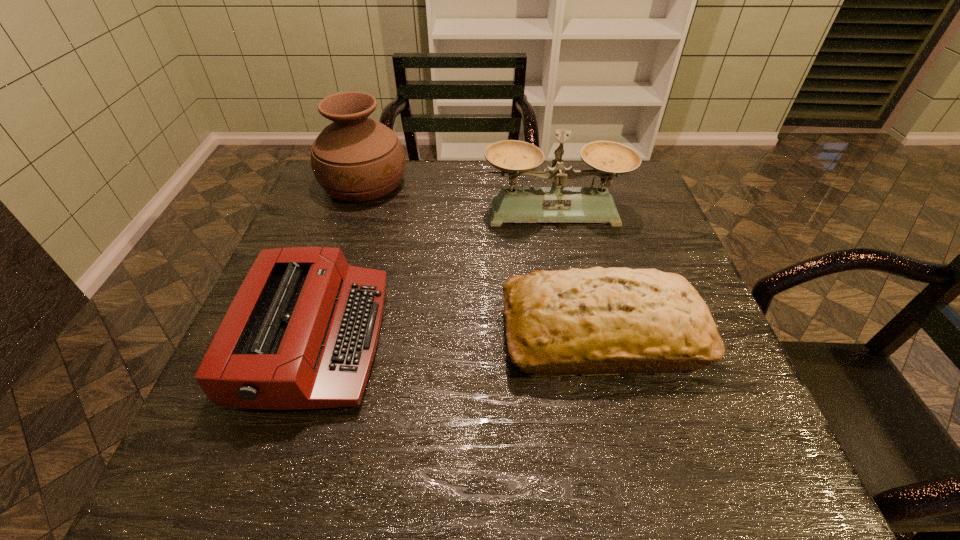
Image resolution: width=960 pixels, height=540 pixels. I want to click on urn, so click(355, 158).

The height and width of the screenshot is (540, 960). Identify the location of scale. coord(557,204).

Locate an element on the screen. the third tallest object is located at coordinates (595, 321).

You are a GUI agent. You are given a task and a screenshot of the screen. Output one action in this format:
    pyautogui.click(x=<x>, y=<y>)
    Task: Click on the typewriter
    
    Given the screenshot: What is the action you would take?
    pyautogui.click(x=301, y=333)

Where is `vacant space located on the right of the urn`? vacant space located on the right of the urn is located at coordinates (469, 183).

The width and height of the screenshot is (960, 540). I want to click on vacant region located on the front-facing side of the scale, so click(568, 279).

Identify the location of free spot located on the left of the bread. Image resolution: width=960 pixels, height=540 pixels. (468, 335).

Find the location of a particular element. This screenshot has width=960, height=540. free spot located on the typing side of the shortest object is located at coordinates (519, 339).

Locate an element on the screen. The image size is (960, 540). urn that is at the far edge is located at coordinates (355, 158).

You are a GUI agent. You are given a task and a screenshot of the screen. Output one action in this format:
    pyautogui.click(x=<x>, y=<y>)
    Task: Click on the scale that is positioned at the far edge
    Image resolution: width=960 pixels, height=540 pixels.
    Given the screenshot: What is the action you would take?
    pyautogui.click(x=557, y=204)